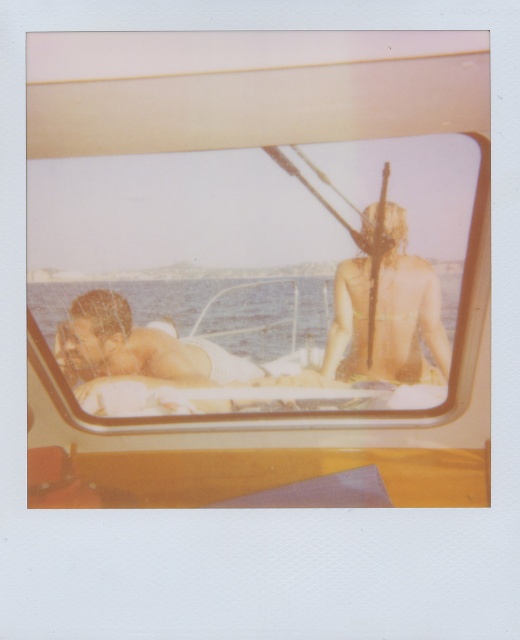
Is smooth white towel at center taller than golden tan skin at center?

No, smooth white towel at center is not taller than golden tan skin at center.

Does smooth white towel at center have a smaller size compared to golden tan skin at center?

Incorrect, smooth white towel at center is not smaller in size than golden tan skin at center.

Is point (210, 372) closer to viewer compared to point (445, 330)?

Yes, point (210, 372) is in front of point (445, 330).

The image size is (520, 640). I want to click on smooth white towel at center, so click(x=153, y=364).

I want to click on wooden boat at center, so [256, 262].

Does point (318, 154) come behind point (93, 330)?

That is True.

This screenshot has width=520, height=640. Find the location of `wooden boat at center`. wooden boat at center is located at coordinates (256, 262).

Who is lower down, wooden boat at center or golden tan skin at center?

golden tan skin at center

Can you confirm if wooden boat at center is bigger than golden tan skin at center?

Correct, wooden boat at center is larger in size than golden tan skin at center.

Is point (477, 163) positioned in front of point (401, 209)?

Yes.

This screenshot has width=520, height=640. Find the location of `wooden boat at center`. wooden boat at center is located at coordinates (256, 262).